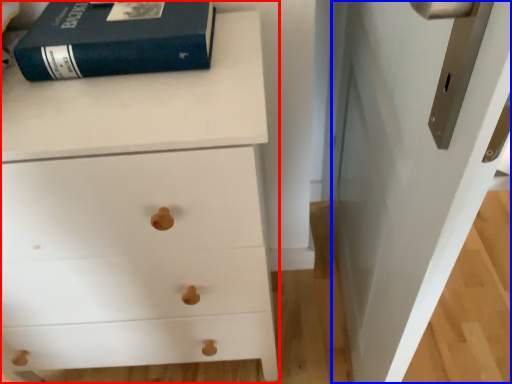
Question: Which of the following is the closest to the observer, chest of drawers (highlighted by a red box) or door (highlighted by a blue box)?

Choices:
 (A) chest of drawers
 (B) door

Answer: (B)